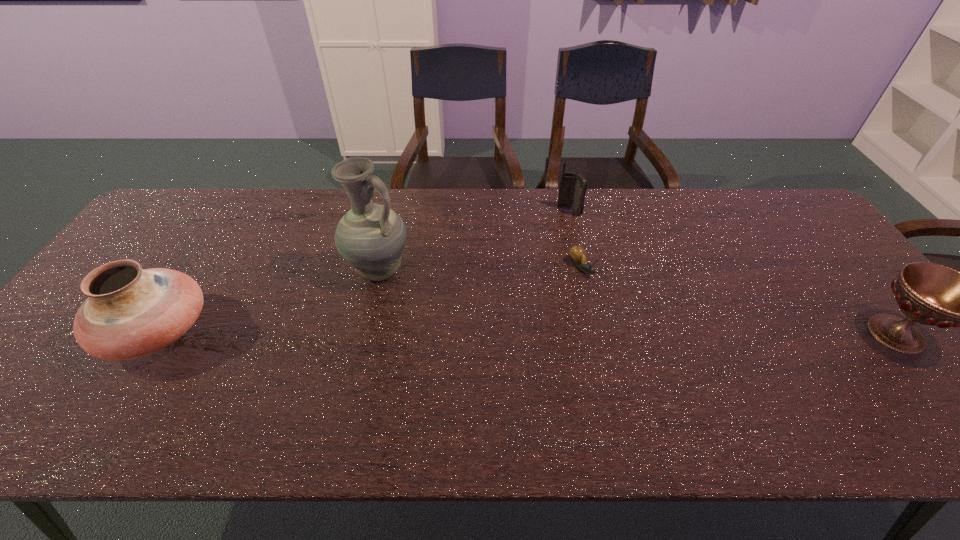
Where is `vacant space on the desktop that is between the pottery and the rightmost object and is positioned on the front-facing side of the shortest object`? The height and width of the screenshot is (540, 960). vacant space on the desktop that is between the pottery and the rightmost object and is positioned on the front-facing side of the shortest object is located at coordinates (636, 333).

The height and width of the screenshot is (540, 960). In order to click on free space on the desktop that is between the leftmost object and the chalice and is positioned on the keyboard of the cellular telephone in this screenshot , I will do `click(574, 333)`.

Where is `vacant space on the desktop that is between the leftmost object and the rightmost object and is positioned on the handle side of the pitcher`? This screenshot has height=540, width=960. vacant space on the desktop that is between the leftmost object and the rightmost object and is positioned on the handle side of the pitcher is located at coordinates (428, 332).